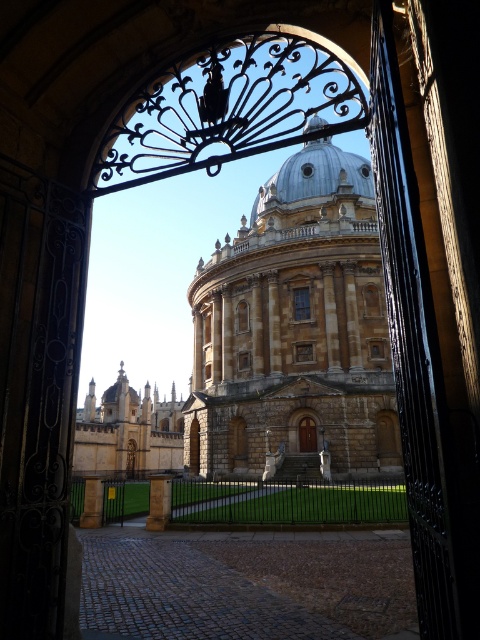
Is smooth stone pillar at center to the left of brown wooden door at center from the viewer's perspective?

Indeed, smooth stone pillar at center is positioned on the left side of brown wooden door at center.

Between point (94, 512) and point (302, 433), which one is positioned in front?

Point (94, 512) is in front.

Find the location of a particular element. The height and width of the screenshot is (640, 480). smooth stone pillar at center is located at coordinates click(x=92, y=502).

Find the location of a particular element. The image size is (480, 640). smooth stone pillar at center is located at coordinates pyautogui.click(x=92, y=502).

Who is shorter, metallic silver dome at center or stone pillar at center?

stone pillar at center

Can you confirm if metallic silver dome at center is smaller than stone pillar at center?

Correct, metallic silver dome at center occupies less space than stone pillar at center.

This screenshot has width=480, height=640. I want to click on metallic silver dome at center, so click(314, 173).

The width and height of the screenshot is (480, 640). Find the location of `metallic silver dome at center`. metallic silver dome at center is located at coordinates (314, 173).

Is the position of stone pillar at center more distant than that of brown wooden door at center?

No.

Between point (159, 481) and point (309, 428), which one is positioned behind?

Point (309, 428)

You are a GUI agent. You are given a task and a screenshot of the screen. Output one action in this format:
    pyautogui.click(x=<x>, y=<y>)
    Task: Click on the stone pillar at center
    The height and width of the screenshot is (640, 480).
    Given the screenshot: What is the action you would take?
    pyautogui.click(x=158, y=500)